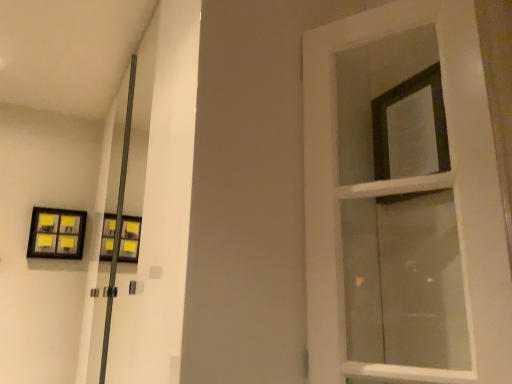
Question: Can you confirm if matte black picture frame at upper left is positioned to the left of white wooden door at right?

Choices:
 (A) yes
 (B) no

Answer: (A)

Question: Is matte black picture frame at upper left thinner than white wooden door at right?

Choices:
 (A) no
 (B) yes

Answer: (A)

Question: Is matte black picture frame at upper left oriented towards white wooden door at right?

Choices:
 (A) yes
 (B) no

Answer: (A)

Question: Does matte black picture frame at upper left have a greater width compared to white wooden door at right?

Choices:
 (A) yes
 (B) no

Answer: (A)

Question: From the image's perspective, is matte black picture frame at upper left below white wooden door at right?

Choices:
 (A) no
 (B) yes

Answer: (B)

Question: Considering the positions of matte black picture frame at upper left and black matte frame at upper right in the image, is matte black picture frame at upper left wider or thinner than black matte frame at upper right?

Choices:
 (A) thin
 (B) wide

Answer: (B)

Question: Choose the correct answer: Is matte black picture frame at upper left inside black matte frame at upper right or outside it?

Choices:
 (A) outside
 (B) inside

Answer: (A)

Question: Is matte black picture frame at upper left in front of or behind black matte frame at upper right in the image?

Choices:
 (A) behind
 (B) front

Answer: (A)

Question: Is matte black picture frame at upper left taller or shorter than black matte frame at upper right?

Choices:
 (A) tall
 (B) short

Answer: (B)

Question: Considering their positions, is black matte frame at upper right located in front of or behind matte black picture frame at upper left?

Choices:
 (A) front
 (B) behind

Answer: (A)

Question: Looking at the image, does black matte frame at upper right seem bigger or smaller compared to matte black picture frame at upper left?

Choices:
 (A) small
 (B) big

Answer: (A)

Question: Does point click(x=415, y=74) appear closer or farther from the camera than point click(x=50, y=218)?

Choices:
 (A) closer
 (B) farther

Answer: (A)

Question: From the image's perspective, is black matte frame at upper right positioned above or below matte black picture frame at upper left?

Choices:
 (A) below
 (B) above

Answer: (B)

Question: From a real-world perspective, relative to white wooden door at right, is matte black picture frame at upper left vertically above or below?

Choices:
 (A) below
 (B) above

Answer: (B)

Question: Is point (35, 238) closer or farther from the camera than point (466, 213)?

Choices:
 (A) closer
 (B) farther

Answer: (B)